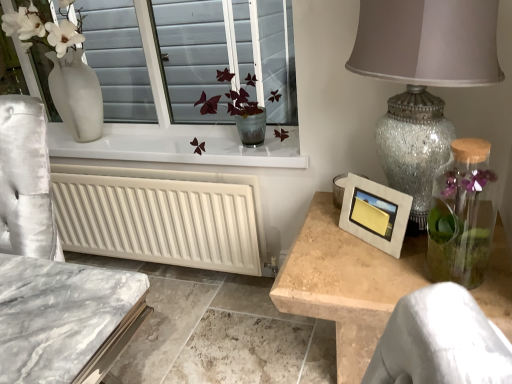
Image resolution: width=512 pixels, height=384 pixels. Identify the location of crackle glass lampshade at right. (428, 43).

Find the location of a particular element. white matte radiator at lower left is located at coordinates (161, 217).

In order to click on matte silver picture frame at right in this screenshot , I will do `click(375, 213)`.

Where is `clear glass vase at right`? The width and height of the screenshot is (512, 384). clear glass vase at right is located at coordinates (462, 215).

Identify the location of glass vase located above the white matte radiator at lower left (from a real-world perspective). The image size is (512, 384). (462, 215).

Is clear glass vase at right at the right side of white matte radiator at lower left?

Yes.

Considering the sizes of clear glass vase at right and white matte radiator at lower left in the image, is clear glass vase at right taller or shorter than white matte radiator at lower left?

Considering their sizes, clear glass vase at right has less height than white matte radiator at lower left.

Does clear glass vase at right have a larger size compared to white matte radiator at lower left?

No.

From the image's perspective, is crackle glass lampshade at right on matte silver picture frame at right?

Yes, from the image's perspective, crackle glass lampshade at right is on top of matte silver picture frame at right.

From a real-world perspective, is crackle glass lampshade at right under matte silver picture frame at right?

No, from a real-world perspective, crackle glass lampshade at right is not beneath matte silver picture frame at right.

At what (x,y) coordinates should I click in order to perform the action: click on picture frame that appears behind the crackle glass lampshade at right. Please return your answer as a coordinate pair (x, y). Looking at the image, I should click on (375, 213).

Is crackle glass lampshade at right wider than matte silver picture frame at right?

Yes.

From a real-world perspective, does matte silver picture frame at right stand above crackle glass lampshade at right?

No, from a real-world perspective, matte silver picture frame at right is not on top of crackle glass lampshade at right.

The width and height of the screenshot is (512, 384). What are the coordinates of `table lamp that is in front of the matte silver picture frame at right` in the screenshot? It's located at (428, 43).

Between matte silver picture frame at right and crackle glass lampshade at right, which one appears on the left side from the viewer's perspective?

matte silver picture frame at right.

Can you tell me how much clear glass vase at right and crackle glass lampshade at right differ in facing direction?

The angular difference between clear glass vase at right and crackle glass lampshade at right is 90 degrees.

Image resolution: width=512 pixels, height=384 pixels. Identify the location of table lamp above the clear glass vase at right (from the image's perspective). (428, 43).

Which of these two, clear glass vase at right or crackle glass lampshade at right, is thinner?

With smaller width is clear glass vase at right.

Can you confirm if clear glass vase at right is positioned to the right of crackle glass lampshade at right?

Indeed, clear glass vase at right is positioned on the right side of crackle glass lampshade at right.

Which object is thinner, white matte radiator at lower left or crackle glass lampshade at right?

With smaller width is white matte radiator at lower left.

Based on the photo, are white matte radiator at lower left and crackle glass lampshade at right far apart?

No, white matte radiator at lower left is not far away from crackle glass lampshade at right.

Does white matte radiator at lower left have a greater height compared to crackle glass lampshade at right?

In fact, white matte radiator at lower left may be shorter than crackle glass lampshade at right.

Based on the photo, from the image's perspective, who appears lower, white matte radiator at lower left or crackle glass lampshade at right?

white matte radiator at lower left is shown below in the image.

Is white matte radiator at lower left directly adjacent to translucent glass vase at center?

No, white matte radiator at lower left is not beside translucent glass vase at center.

Is white matte radiator at lower left positioned with its back to translucent glass vase at center?

No.

Identify the location of glass vase on the right of translucent glass vase at center. (462, 215).

Which point is more distant from viewer, (474, 223) or (216, 108)?

The point (216, 108) is farther.

Is clear glass vase at right positioned behind translucent glass vase at center?

No, clear glass vase at right is closer to the viewer.

Does clear glass vase at right turn towards translucent glass vase at center?

No, clear glass vase at right is not facing towards translucent glass vase at center.

You are a GUI agent. You are given a task and a screenshot of the screen. Output one action in this format:
    pyautogui.click(x=<x>, y=<y>)
    Task: Click on the radiator that appears behind the clear glass vase at right
    The height and width of the screenshot is (384, 512).
    Given the screenshot: What is the action you would take?
    pyautogui.click(x=161, y=217)

At what (x,y) coordinates should I click in order to perform the action: click on table lamp located in front of the matte silver picture frame at right. Please return your answer as a coordinate pair (x, y). This screenshot has height=384, width=512. Looking at the image, I should click on (428, 43).

Looking at the image, which one is located closer to white matte radiator at lower left, translucent glass vase at center or matte silver picture frame at right?

translucent glass vase at center is positioned closer to the anchor white matte radiator at lower left.

Consider the image. Estimate the real-world distances between objects in this image. Which object is closer to clear glass vase at right, translucent glass vase at center or matte silver picture frame at right?

matte silver picture frame at right lies closer to clear glass vase at right than the other object.

Considering their positions, is translucent glass vase at center positioned further to white matte radiator at lower left than crackle glass lampshade at right?

crackle glass lampshade at right is further to white matte radiator at lower left.

Consider the image. Based on their spatial positions, is white matte radiator at lower left or translucent glass vase at center closer to matte silver picture frame at right?

translucent glass vase at center is closer to matte silver picture frame at right.

When comparing their distances from white matte radiator at lower left, does crackle glass lampshade at right or matte silver picture frame at right seem closer?

Among the two, matte silver picture frame at right is located nearer to white matte radiator at lower left.

Based on their spatial positions, is white matte radiator at lower left or translucent glass vase at center closer to clear glass vase at right?

translucent glass vase at center is closer to clear glass vase at right.

When comparing their distances from crackle glass lampshade at right, does matte silver picture frame at right or translucent glass vase at center seem further?

The object further to crackle glass lampshade at right is translucent glass vase at center.

From the image, which object appears to be nearer to crackle glass lampshade at right, white matte radiator at lower left or translucent glass vase at center?

translucent glass vase at center is positioned closer to the anchor crackle glass lampshade at right.

At what (x,y) coordinates should I click in order to perform the action: click on picture frame between crackle glass lampshade at right and translucent glass vase at center along the z-axis. Please return your answer as a coordinate pair (x, y). Image resolution: width=512 pixels, height=384 pixels. Looking at the image, I should click on (375, 213).

This screenshot has height=384, width=512. What are the coordinates of `floral arrangement between white matte radiator at lower left and clear glass vase at right` in the screenshot? It's located at (247, 117).

The height and width of the screenshot is (384, 512). I want to click on picture frame between white matte radiator at lower left and clear glass vase at right in the horizontal direction, so click(x=375, y=213).

Identify the location of glass vase between crackle glass lampshade at right and matte silver picture frame at right vertically. This screenshot has width=512, height=384. (462, 215).